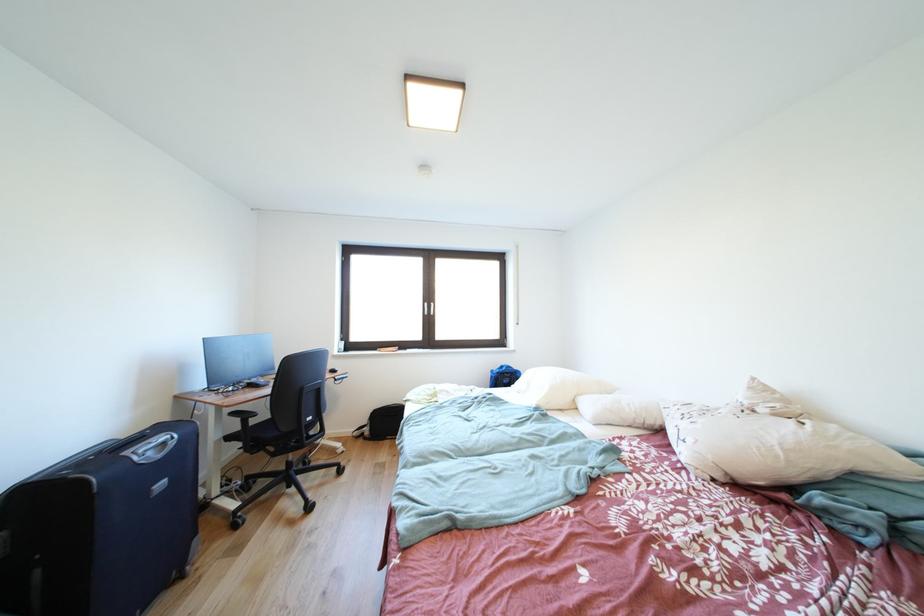
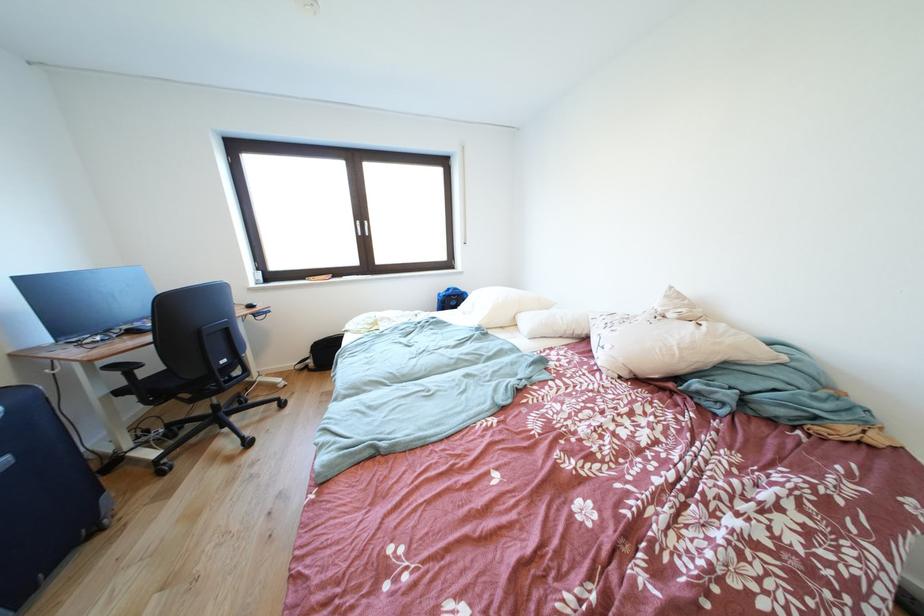
Locate, in the second image, the point that corresponds to pixel 434 310 in the first image.

(367, 228)